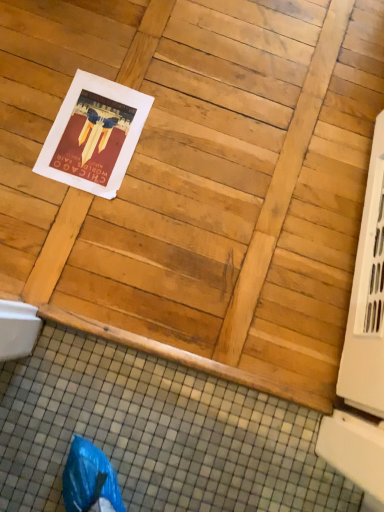
Identify the location of vacant area that is in front of white paper poster at upper left. (64, 221).